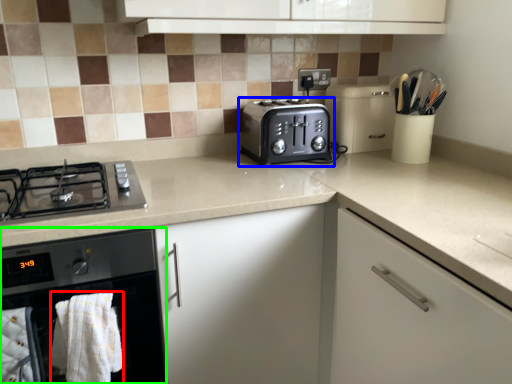
Question: Which object is positioned closest to bath towel (highlighted by a red box)? Select from toaster (highlighted by a blue box) and home appliance (highlighted by a green box).

Choices:
 (A) toaster
 (B) home appliance

Answer: (B)